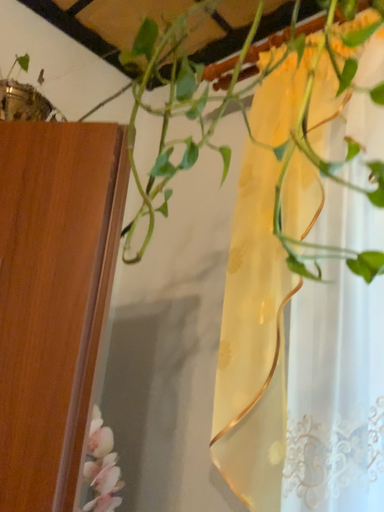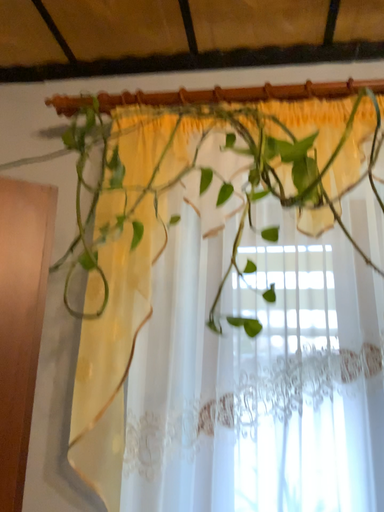
Question: Which way did the camera rotate in the video?

Choices:
 (A) rotated left
 (B) rotated right

Answer: (B)